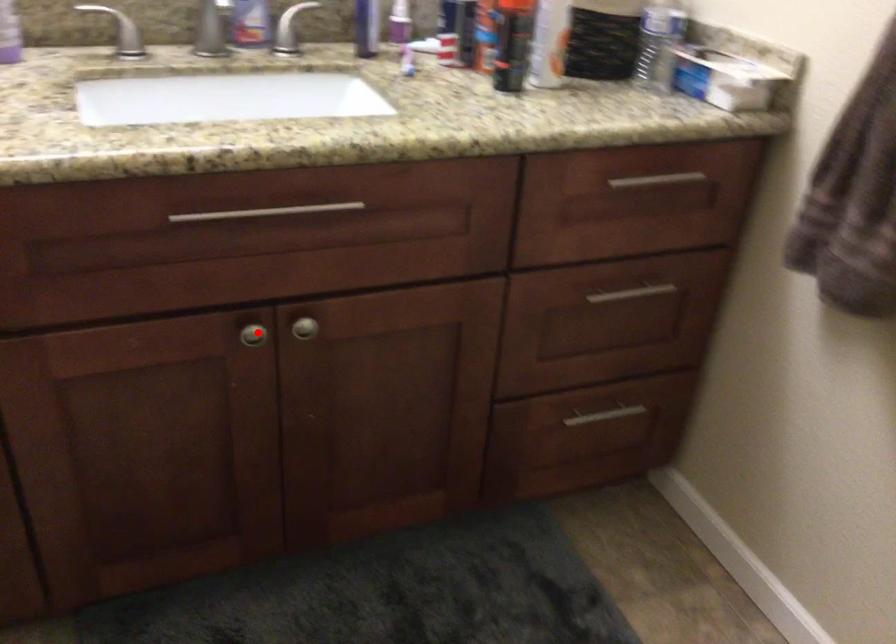
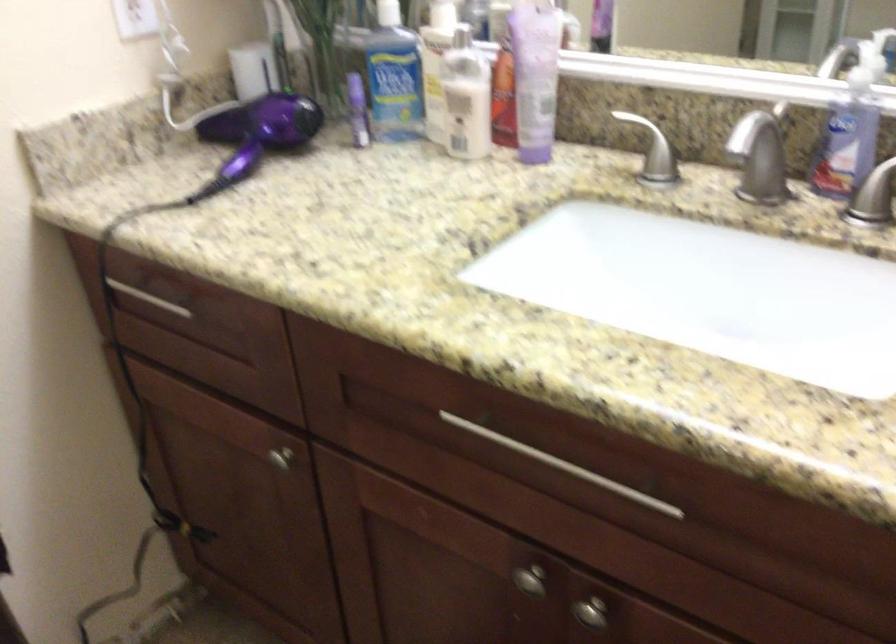
The point at the highlighted location is marked in the first image. Where is the corresponding point in the second image?

(530, 580)